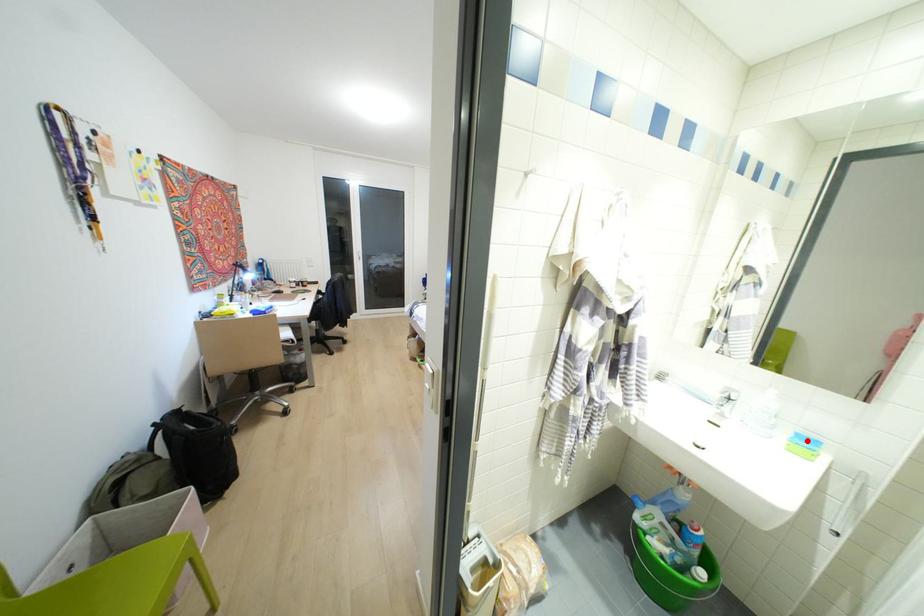
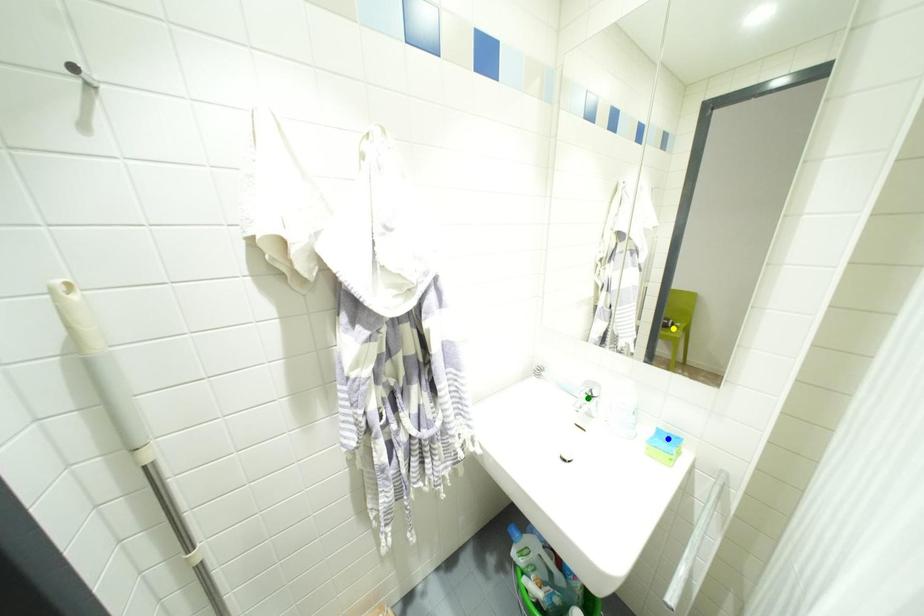
Question: I am providing you with two images of the same scene from different viewpoints. A red point is marked on the first image. You are given multiple points on the second image. Which point in image 2 represents the same 3d spot as the red point in image 1?

Choices:
 (A) yellow point
 (B) blue point
 (C) green point

Answer: (B)